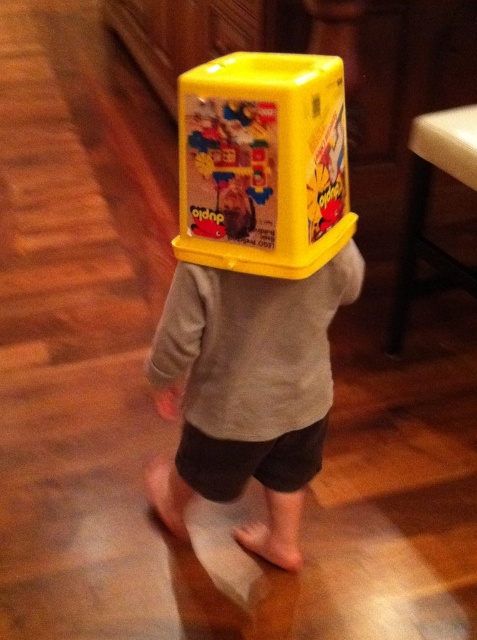
You are a parent trying to organize the playroom. You have a yellow plastic container at back and a white plastic stool at lower right. If you want to place the yellow plastic container on top of the white plastic stool, will it fit? Please consider the distance between them.

The distance between the yellow plastic container at back and the white plastic stool at lower right is 67.64 centimeters. However, the distance provided refers to their separation in the room, not the dimensions of the container or stool. To determine if the container fits on the stool, you need to know the base dimensions of both objects. Since this information isn

Looking at this image, you are organizing a playroom and need to arrange the yellow plastic container at back and the white plastic stool at lower right. If you want to place both items side by side without overlapping, which item should you position first to ensure there is enough space?

Since the yellow plastic container at back occupies less space than the white plastic stool at lower right, you should position the white plastic stool at lower right first to ensure there is enough space for both items.